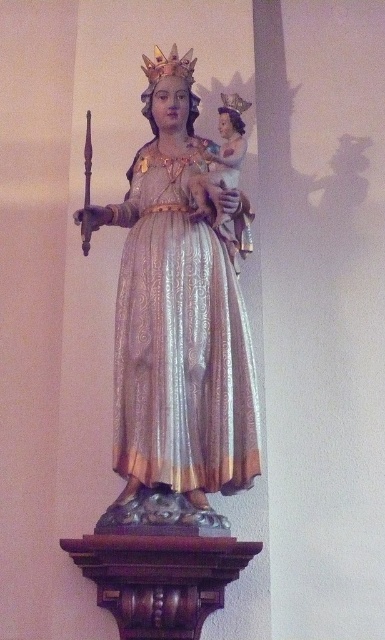
From the picture: Between shiny gold statue at center and silvery metallic dress at center, which one is positioned higher?

Positioned higher is silvery metallic dress at center.

Can you confirm if shiny gold statue at center is shorter than silvery metallic dress at center?

No.

Find the location of a particular element. shiny gold statue at center is located at coordinates (179, 321).